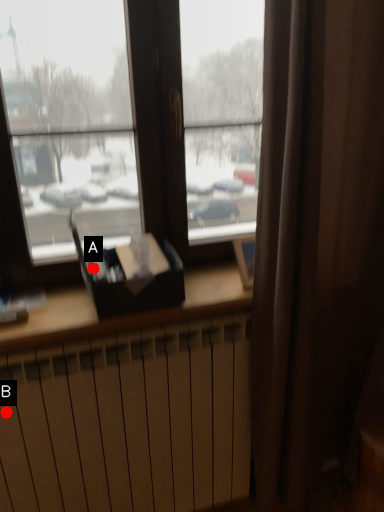
Question: Two points are circled on the image, labeled by A and B beside each circle. Which point appears farthest from the camera in this image?

Choices:
 (A) A is further
 (B) B is further

Answer: (A)